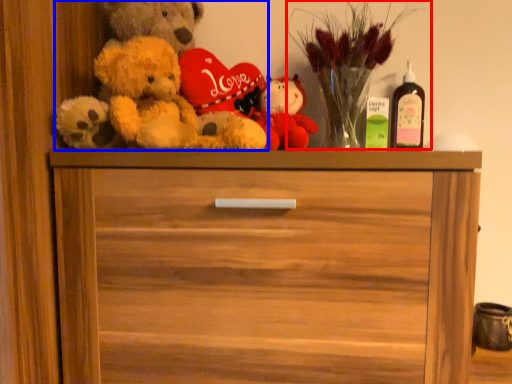
Question: Which object is closer to the camera taking this photo, floral arrangement (highlighted by a red box) or teddy bear (highlighted by a blue box)?

Choices:
 (A) floral arrangement
 (B) teddy bear

Answer: (B)